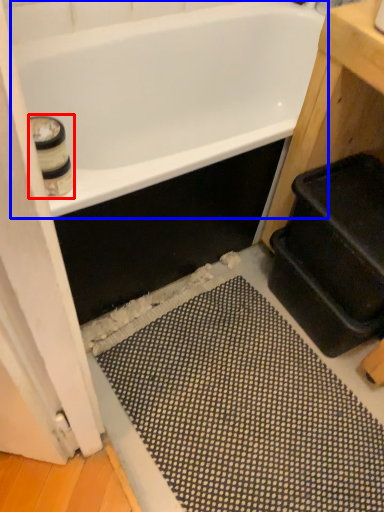
Question: Among these objects, which one is farthest to the camera, toilet paper (highlighted by a red box) or bathtub (highlighted by a blue box)?

Choices:
 (A) toilet paper
 (B) bathtub

Answer: (B)